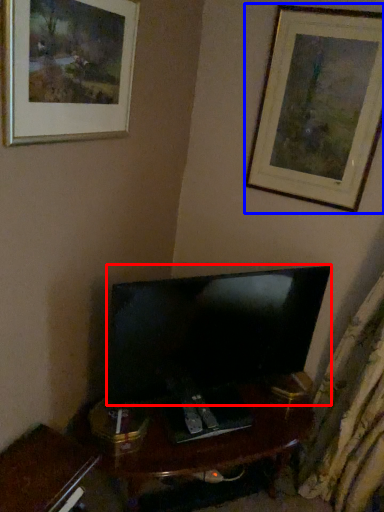
Question: Which point is closer to the camera, television (highlighted by a red box) or picture frame (highlighted by a blue box)?

Choices:
 (A) television
 (B) picture frame

Answer: (A)